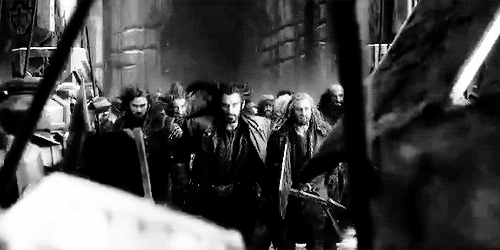
At what (x,y) coordinates should I click in order to perform the action: click on wall on left. Please return your answer as a coordinate pair (x, y). The width and height of the screenshot is (500, 250). Looking at the image, I should click on (109, 16).